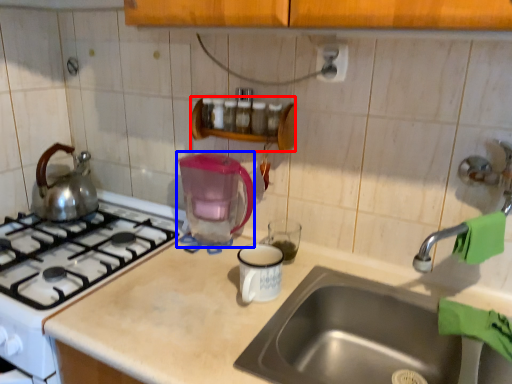
Question: Which object appears closest to the camera in this image, shelf (highlighted by a red box) or coffeepot (highlighted by a blue box)?

Choices:
 (A) shelf
 (B) coffeepot

Answer: (B)